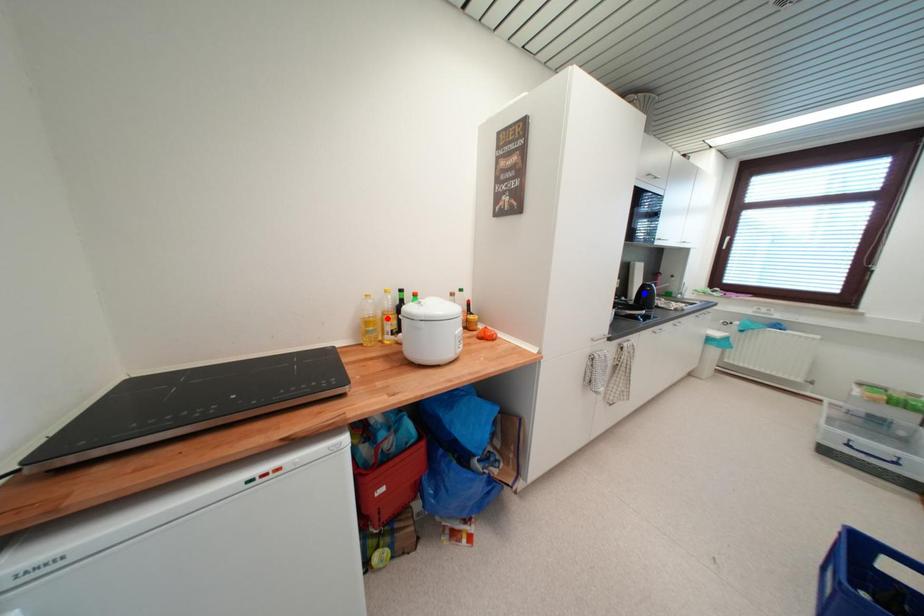
Question: Which of the two points in the image is closer to the camera?

Choices:
 (A) Blue point is closer.
 (B) Red point is closer.

Answer: (B)